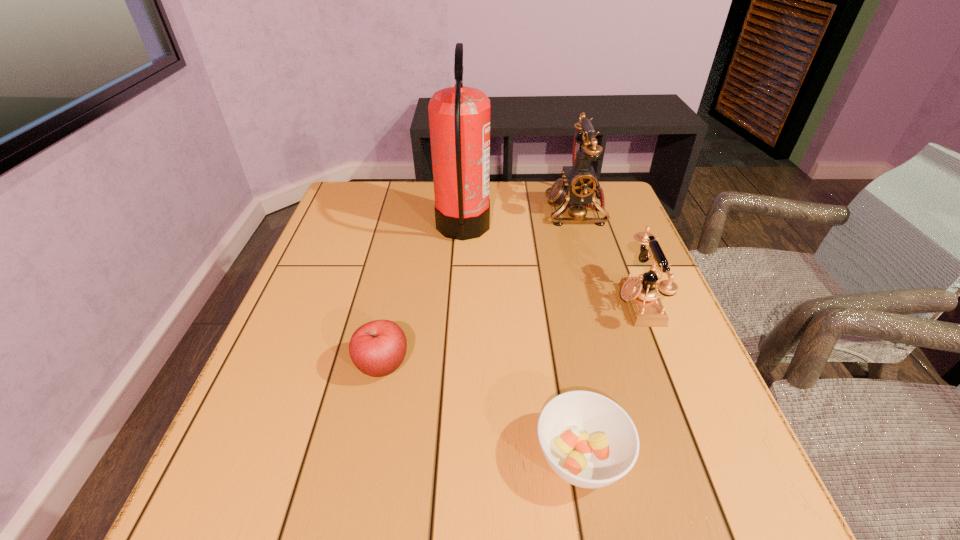
This screenshot has height=540, width=960. I want to click on object that is the closest to the shortest object, so click(640, 294).

Where is `object that can be found as the third closest to the soup bowl`? object that can be found as the third closest to the soup bowl is located at coordinates (459, 117).

I want to click on vacant region that satisfies the following two spatial constraints: 1. on the dial of the nearer telephone; 2. on the front side of the soup bowl, so [x=698, y=457].

I want to click on vacant region that satisfies the following two spatial constraints: 1. on the dial of the third shortest object; 2. on the front side of the second shortest object, so click(662, 366).

Locate an element on the screen. blank area in the image that satisfies the following two spatial constraints: 1. on the front side of the leftmost object; 2. on the left side of the nearest object is located at coordinates (364, 457).